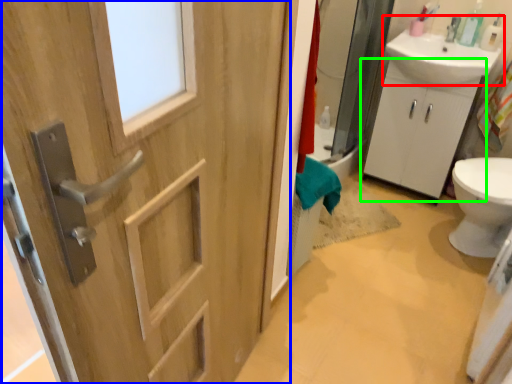
Question: Which is farther away from sink (highlighted by a red box)? door (highlighted by a blue box) or bathroom cabinet (highlighted by a green box)?

Choices:
 (A) door
 (B) bathroom cabinet

Answer: (A)